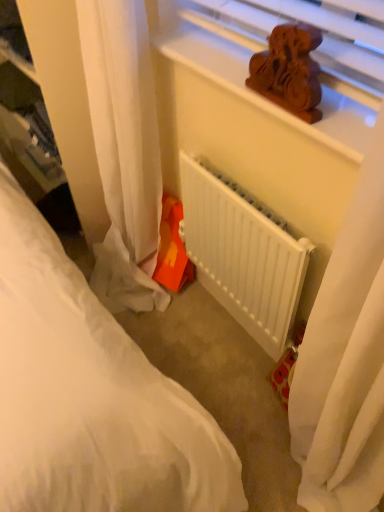
I want to click on vacant space to the left of orange plastic toy at lower center, so click(124, 300).